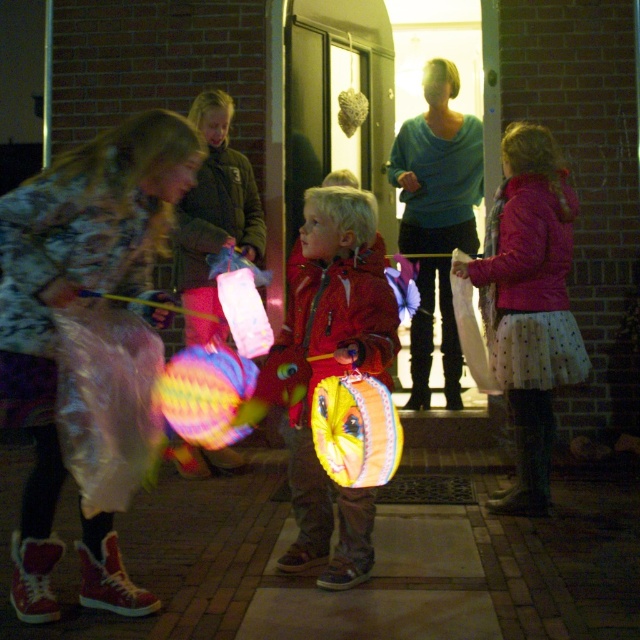
Does shiny red jacket at center have a smaller size compared to polka dot skirt at center?

No, shiny red jacket at center is not smaller than polka dot skirt at center.

Based on the photo, who is more distant from viewer, [376,243] or [568,316]?

The point [568,316] is more distant.

Identify the location of shiny red jacket at center. The width and height of the screenshot is (640, 640). (330, 371).